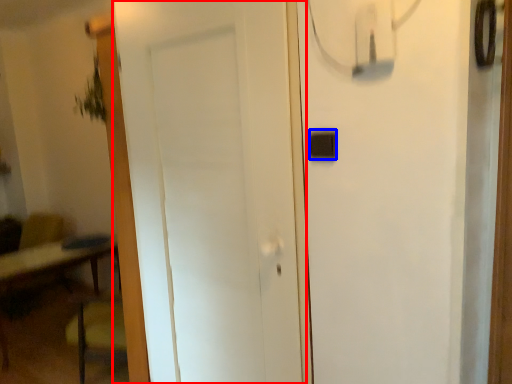
Question: Which object appears farthest to the camera in this image, door (highlighted by a red box) or light switch (highlighted by a blue box)?

Choices:
 (A) door
 (B) light switch

Answer: (B)